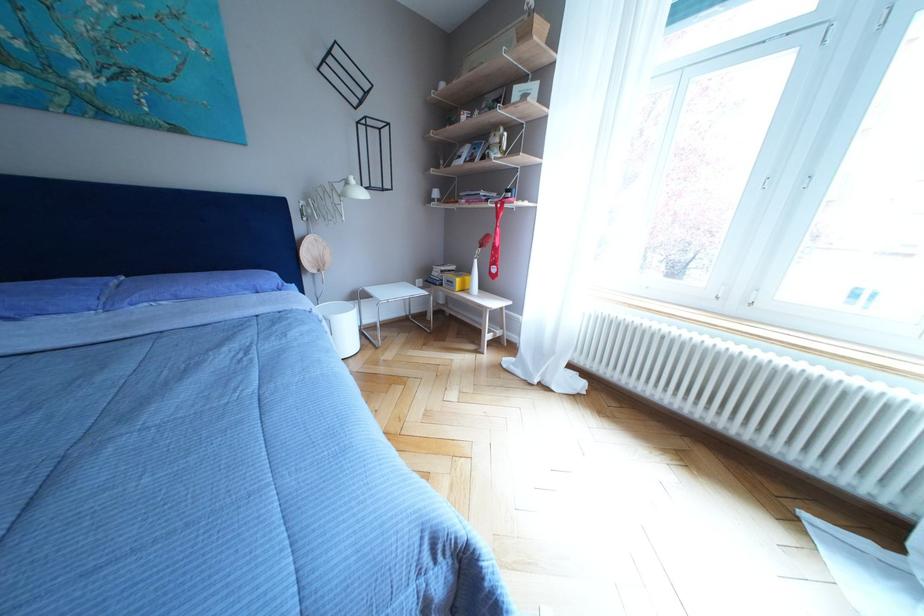
The image size is (924, 616). What do you see at coordinates (314, 257) in the screenshot? I see `the hand fan` at bounding box center [314, 257].